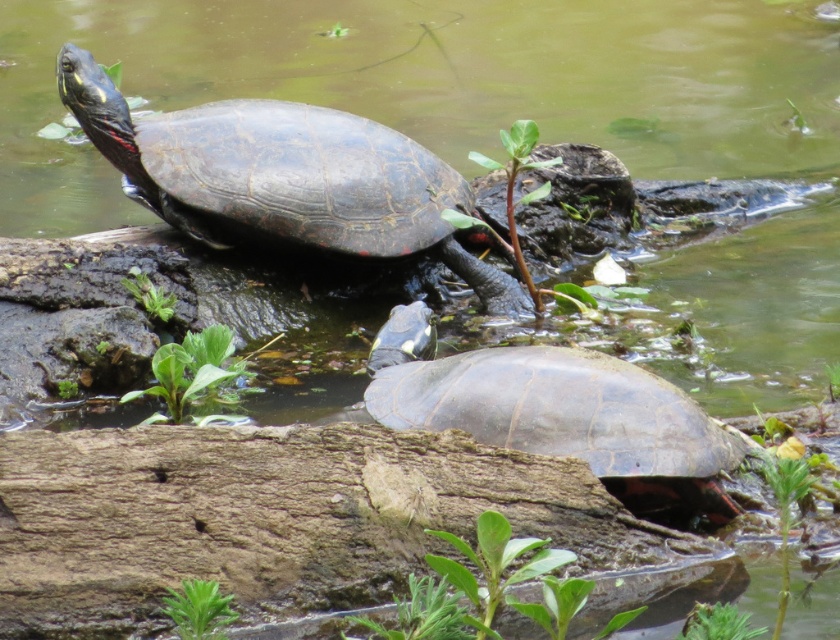
You are a photographer trying to capture both the shiny dark turtle at upper left and the shiny dark gray tortoise at center in a single shot. Given their heights, which turtle will appear larger in the photo?

The shiny dark turtle at upper left will appear larger in the photo because it is much taller than the shiny dark gray tortoise at center.

You are a photographer trying to capture both the shiny dark turtle at upper left and the shiny dark gray tortoise at center in a single frame. Based on their positions, which turtle is positioned to the left of the other?

The shiny dark turtle at upper left is positioned to the left of the shiny dark gray tortoise at center.